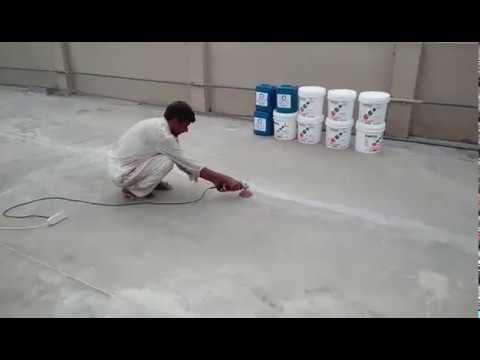
Identify the location of power cable. This screenshot has width=480, height=360. (57, 218).